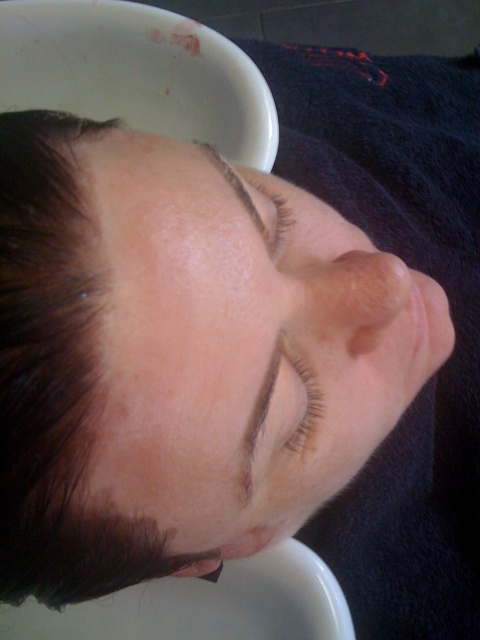
Identify the location of smooth skin at center. Image resolution: width=480 pixels, height=640 pixels. (237, 346).

Is smooth skin at center above brown matte eyelashes at upper center?

Incorrect, smooth skin at center is not positioned above brown matte eyelashes at upper center.

Locate an element on the screen. smooth skin at center is located at coordinates [237, 346].

Which is below, dark brown hair at upper left or smooth skin nose at center?

dark brown hair at upper left is lower down.

Is point (24, 566) positioned before point (361, 298)?

Yes, it is in front of point (361, 298).

The height and width of the screenshot is (640, 480). I want to click on dark brown hair at upper left, so click(x=55, y=380).

I want to click on dark brown hair at upper left, so click(55, 380).

Which of these two, smooth skin at center or smooth skin nose at center, stands shorter?

smooth skin nose at center is shorter.

Is point (199, 419) farther from viewer compared to point (387, 314)?

No, (199, 419) is closer to viewer.

Which is in front, point (200, 288) or point (359, 292)?

Positioned in front is point (200, 288).

Where is `smooth skin at center`? smooth skin at center is located at coordinates (237, 346).